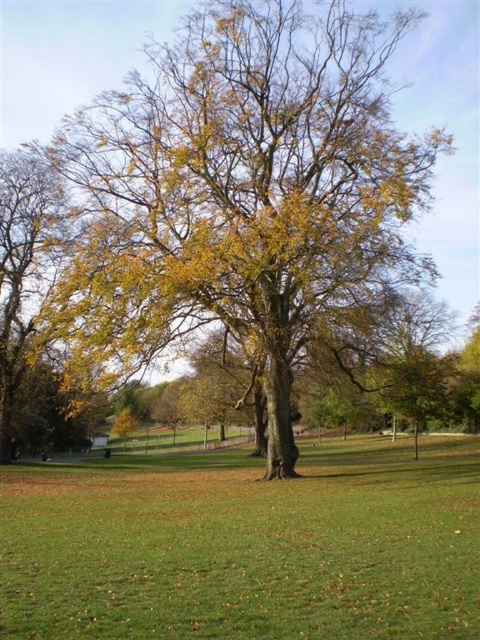
You are standing at point (414,536) and want to walk to the large tree in the center of the park. Is the point (322,32) in your direct path towards the tree?

Yes, the point (322,32) is behind point (414,536), meaning it lies along the path from your current position to the large tree in the center of the park.

Based on the scene description, what object is located at the coordinates point [247,186]?

The point [247,186] indicates the yellow green leafy oak tree at center.